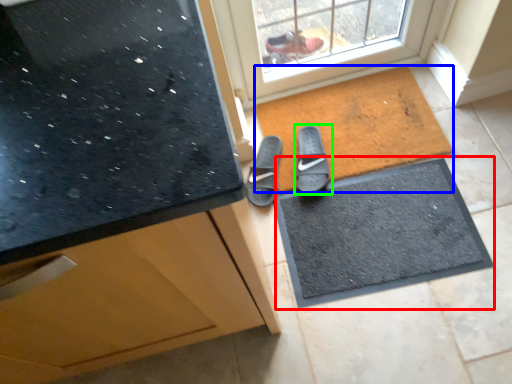
Question: Estimate the real-world distances between objects in this image. Which object is closer to doormat (highlighted by a red box), mat (highlighted by a blue box) or footwear (highlighted by a green box)?

Choices:
 (A) mat
 (B) footwear

Answer: (A)